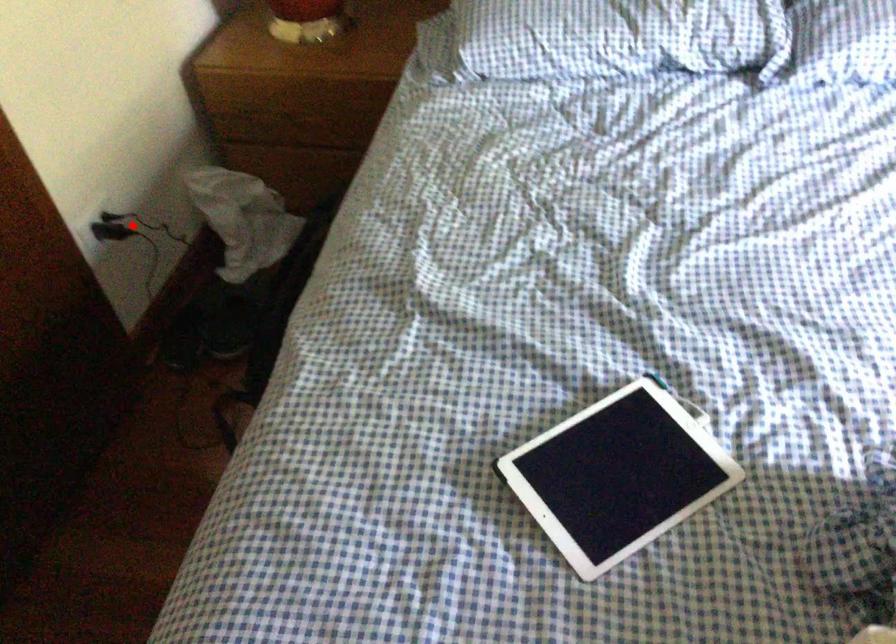
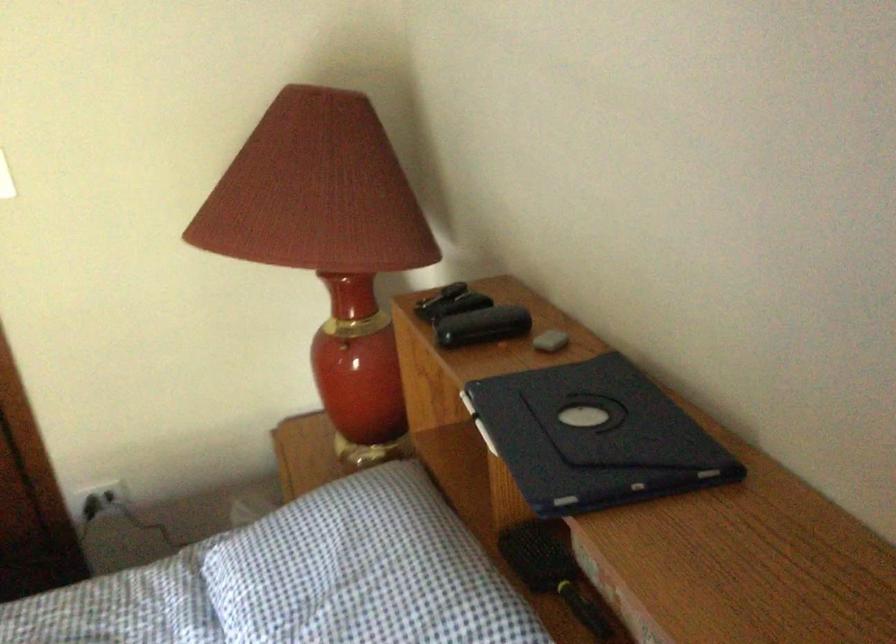
Question: A red point is marked in image1. In image2, is the corresponding 3D point closer to the camera or farther? Reply with the corresponding letter.

Choices:
 (A) The corresponding 3D point is closer.
 (B) The corresponding 3D point is farther.

Answer: (B)